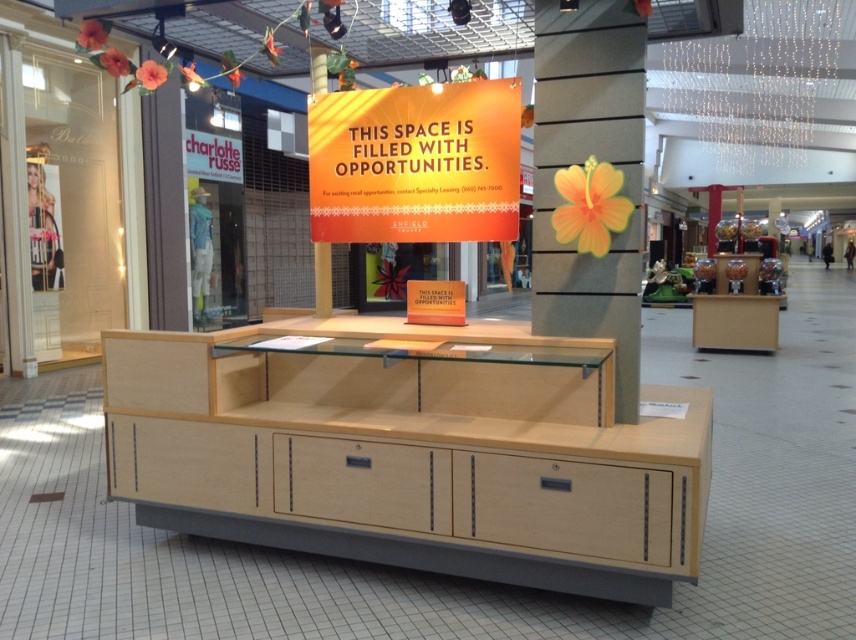
Question: Can you confirm if matte wood pillar at center is positioned above orange matte sign at center?

Choices:
 (A) no
 (B) yes

Answer: (A)

Question: Does light wood cabinet at center have a larger size compared to light wood drawer at lower left?

Choices:
 (A) no
 (B) yes

Answer: (B)

Question: Can you confirm if light wood cabinet at center is smaller than matte wood pillar at center?

Choices:
 (A) no
 (B) yes

Answer: (A)

Question: Which point is farther to the camera?

Choices:
 (A) light wood cabinet at center
 (B) light wood drawer at lower left
 (C) matte wood pillar at center

Answer: (B)

Question: Which point appears farthest from the camera in this image?

Choices:
 (A) (557, 115)
 (B) (634, 545)

Answer: (A)

Question: Which point is farther to the camera?

Choices:
 (A) light wood cabinet at center
 (B) light wood drawer at center

Answer: (B)